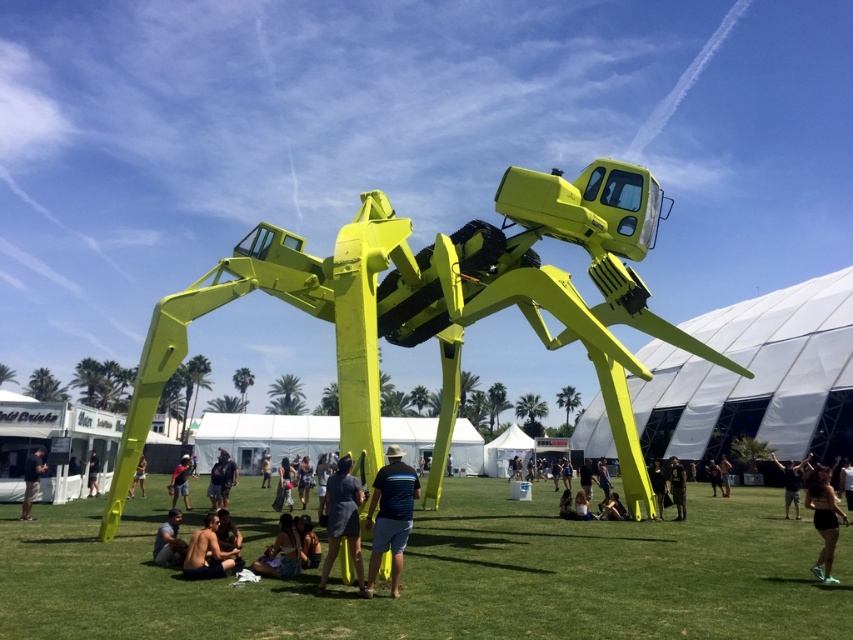
Which of these two, black matte person at center or black matte shirt at center, stands taller?

Standing taller between the two is black matte person at center.

Identify the location of black matte person at center. (791, 481).

Is point (177, 524) farther from camera compared to point (717, 474)?

No, it is in front of (717, 474).

The width and height of the screenshot is (853, 640). What do you see at coordinates (169, 541) in the screenshot? I see `matte black shorts at lower center` at bounding box center [169, 541].

At what (x,y) coordinates should I click in order to perform the action: click on matte black shorts at lower center. Please return your answer as a coordinate pair (x, y). Looking at the image, I should click on (169, 541).

Is matte black shorts at lower center further to the viewer compared to skinny jeans at center?

No, matte black shorts at lower center is in front of skinny jeans at center.

Which is above, matte black shorts at lower center or skinny jeans at center?

matte black shorts at lower center is higher up.

Which is in front, point (167, 538) or point (723, 472)?

Point (167, 538)

Where is `matte black shorts at lower center`? matte black shorts at lower center is located at coordinates pyautogui.click(x=169, y=541).